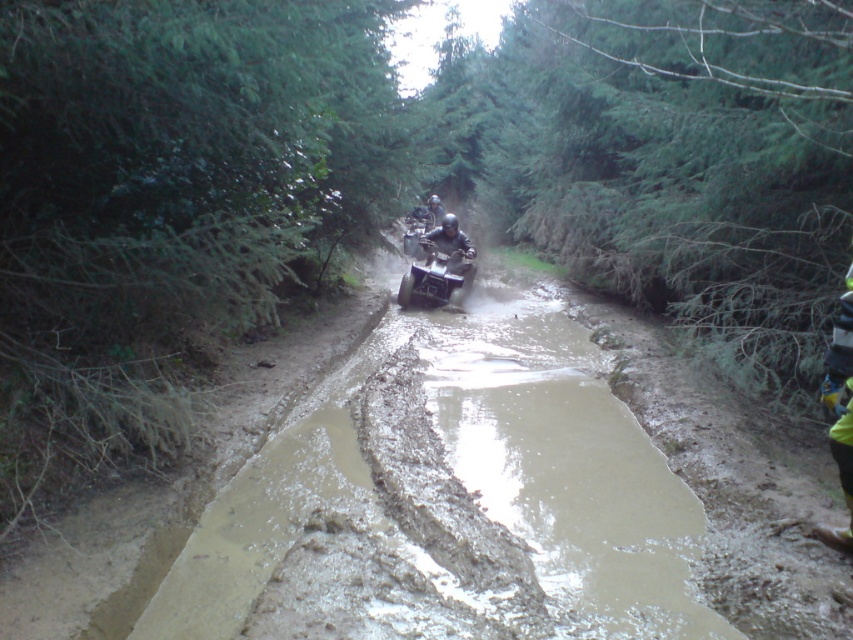
Is metallic silver quad bike at center to the left of matte black quad bike at center from the viewer's perspective?

Correct, you'll find metallic silver quad bike at center to the left of matte black quad bike at center.

Does metallic silver quad bike at center have a larger size compared to matte black quad bike at center?

Correct, metallic silver quad bike at center is larger in size than matte black quad bike at center.

The width and height of the screenshot is (853, 640). Find the location of `metallic silver quad bike at center`. metallic silver quad bike at center is located at coordinates (439, 269).

Where is `metallic silver quad bike at center`? This screenshot has width=853, height=640. metallic silver quad bike at center is located at coordinates (439, 269).